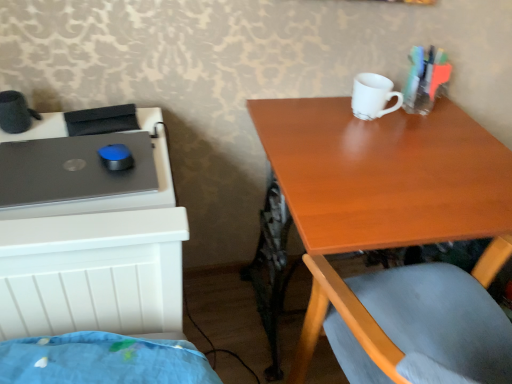
Image resolution: width=512 pixels, height=384 pixels. What are the coordinates of `vacant area in front of white matte mug at upper center` in the screenshot? It's located at (375, 146).